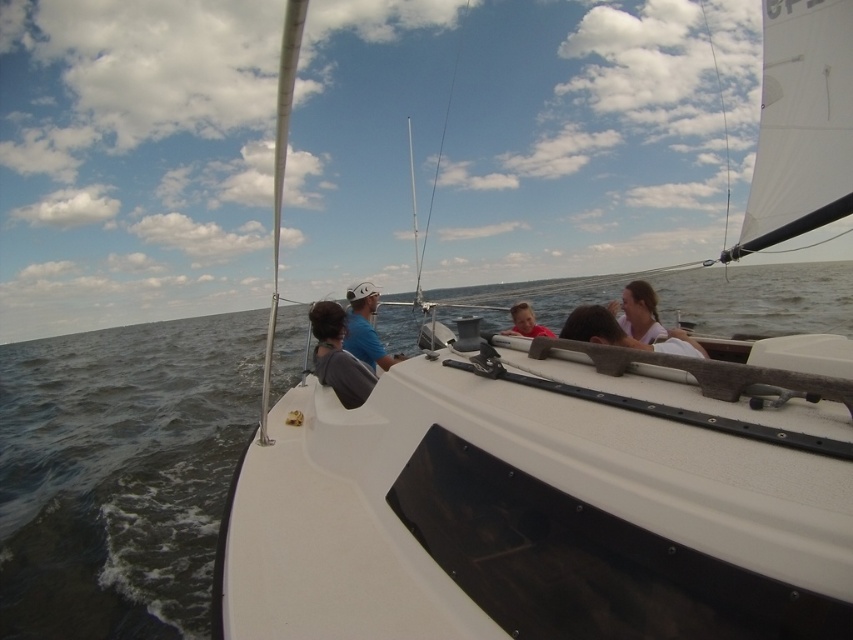
Which is more to the left, matte gray shirt at center or matte pink shirt at center?

From the viewer's perspective, matte gray shirt at center appears more on the left side.

Is matte gray shirt at center closer to the viewer compared to matte pink shirt at center?

Yes, it is.

Locate an element on the screen. The height and width of the screenshot is (640, 853). matte gray shirt at center is located at coordinates (338, 356).

Between matte blue shirt at center and white fabric shirt at center, which one has less height?

Standing shorter between the two is white fabric shirt at center.

Which of these two, matte blue shirt at center or white fabric shirt at center, stands taller?

With more height is matte blue shirt at center.

Is point (352, 342) more distant than point (619, 333)?

That is True.

You are a GUI agent. You are given a task and a screenshot of the screen. Output one action in this format:
    pyautogui.click(x=<x>, y=<y>)
    Task: Click on the matte blue shirt at center
    
    Given the screenshot: What is the action you would take?
    pyautogui.click(x=364, y=326)

Does point (628, 282) come behind point (618, 333)?

Yes.

Who is higher up, pink fabric hair at upper right or white fabric shirt at center?

pink fabric hair at upper right is higher up.

Between point (621, 305) and point (625, 346), which one is positioned behind?

The point (621, 305) is behind.

Identify the location of pink fabric hair at upper right. (637, 312).